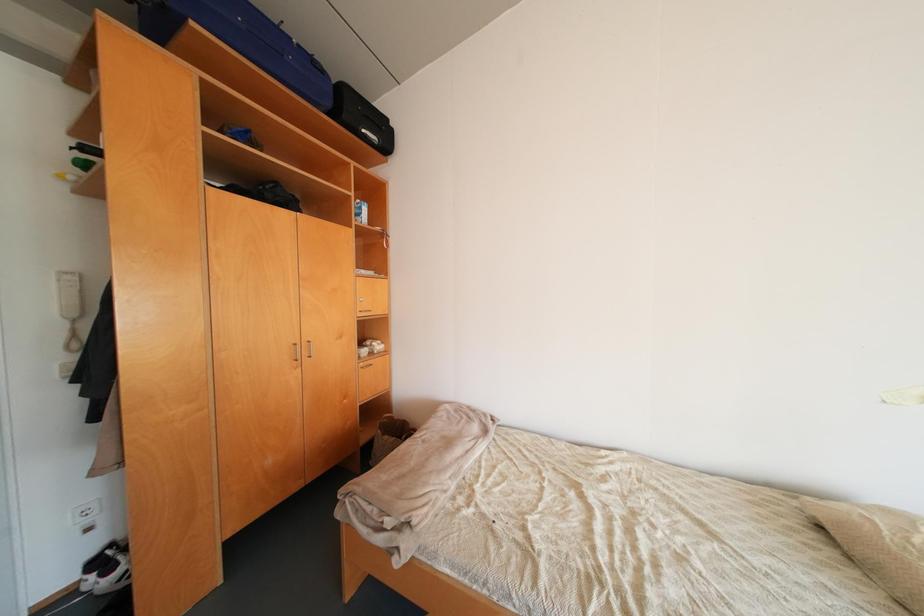
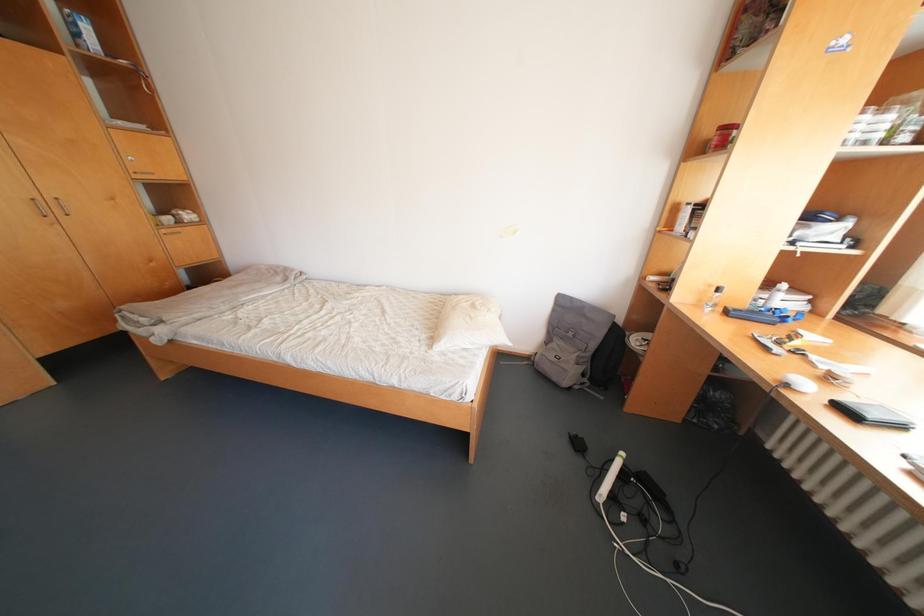
Which direction would the cameraman need to move to produce the second image?

The cameraman walked toward right, backward.